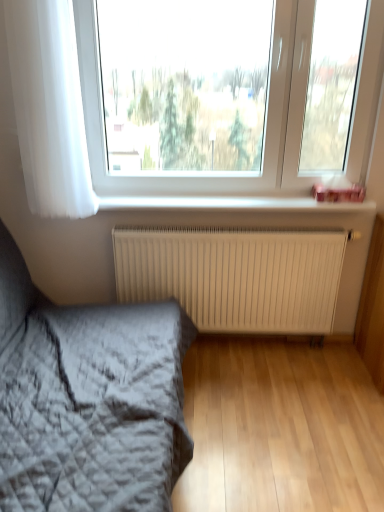
Locate an element on the screen. vacant space underneath white plastic window at upper center (from a real-world perspective) is located at coordinates (225, 196).